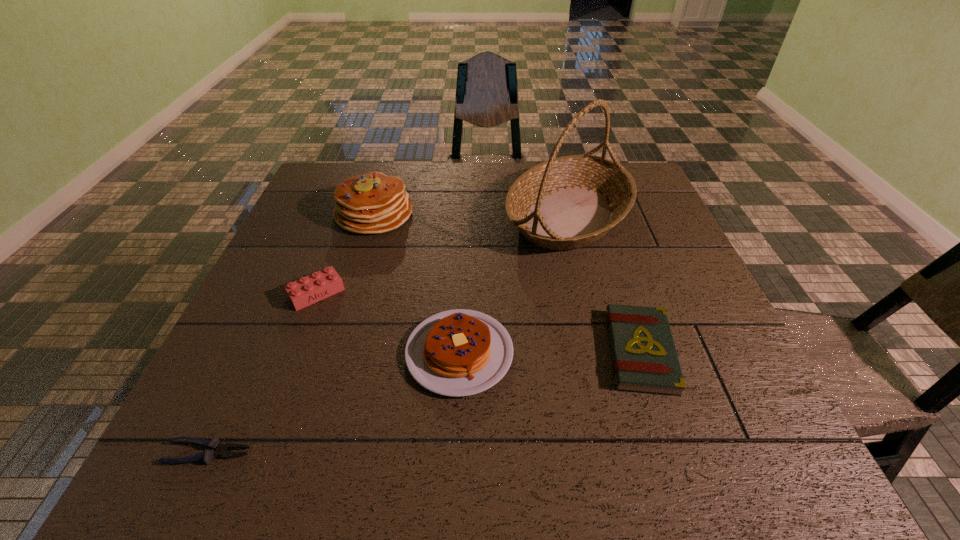
Find the location of a particular element. The height and width of the screenshot is (540, 960). basket is located at coordinates (568, 202).

Identify the location of the farther pancake. The image size is (960, 540). (372, 203).

You are a GUI agent. You are given a task and a screenshot of the screen. Output one action in this format:
    pyautogui.click(x=<x>, y=<y>)
    Task: Click on the taller pancake
    
    Given the screenshot: What is the action you would take?
    pyautogui.click(x=372, y=203)

Locate an element on the screen. the shorter pancake is located at coordinates (460, 352).

You are a GUI agent. You are given a task and a screenshot of the screen. Output one action in this format:
    pyautogui.click(x=<x>, y=<y>)
    Task: Click on the right pancake
    The height and width of the screenshot is (540, 960).
    Given the screenshot: What is the action you would take?
    pyautogui.click(x=460, y=352)

Identify the location of Lego. This screenshot has height=540, width=960. (308, 290).

Image resolution: width=960 pixels, height=540 pixels. In order to click on book in this screenshot , I will do `click(644, 357)`.

This screenshot has width=960, height=540. I want to click on the shortest object, so click(x=217, y=449).

The width and height of the screenshot is (960, 540). Identify the location of pliers. (217, 449).

This screenshot has height=540, width=960. Find the location of `vacant space located 0.300m on the front of the basket`. vacant space located 0.300m on the front of the basket is located at coordinates (606, 363).